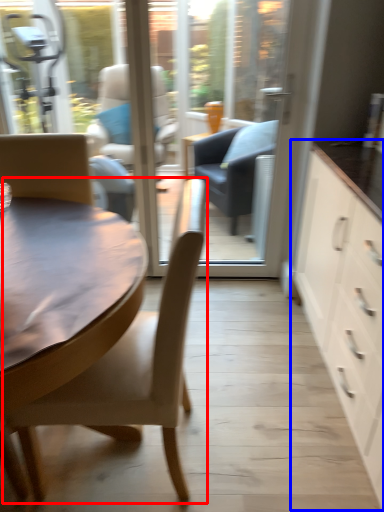
Question: Which point is closer to the camera, chair (highlighted by a red box) or cabinetry (highlighted by a blue box)?

Choices:
 (A) chair
 (B) cabinetry

Answer: (B)